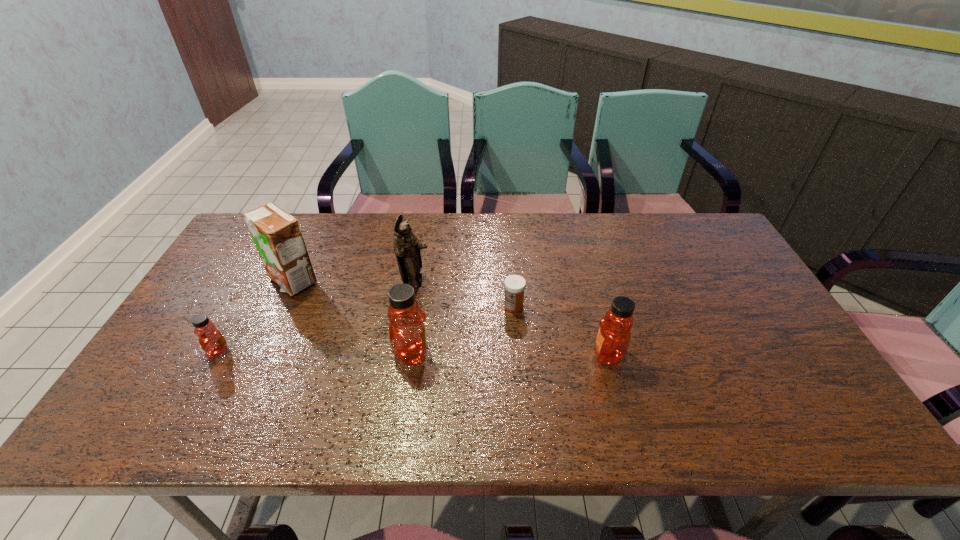
Identify the location of the shortest honey. (213, 343).

Locate an element on the screen. the leftmost honey is located at coordinates (213, 343).

Find the location of a particular element. the second honey from right to left is located at coordinates (407, 334).

Find the location of a particular element. This screenshot has height=540, width=960. the third shortest object is located at coordinates (613, 339).

Identify the location of the rightmost object. This screenshot has width=960, height=540. (613, 339).

Where is `figurine`? The height and width of the screenshot is (540, 960). figurine is located at coordinates (406, 246).

What are the coordinates of `carton` in the screenshot? It's located at (277, 235).

At what (x,y) coordinates should I click in order to perform the action: click on medicine. Please return your answer as a coordinate pair (x, y). Looking at the image, I should click on (514, 285).

Locate an element on the screen. This screenshot has height=540, width=960. the fourth nearest object is located at coordinates (514, 285).

At what (x,y) coordinates should I click in order to perform the action: click on free space located on the front label of the leftmost honey. Please return your answer as a coordinate pair (x, y). The width and height of the screenshot is (960, 540). Looking at the image, I should click on (171, 352).